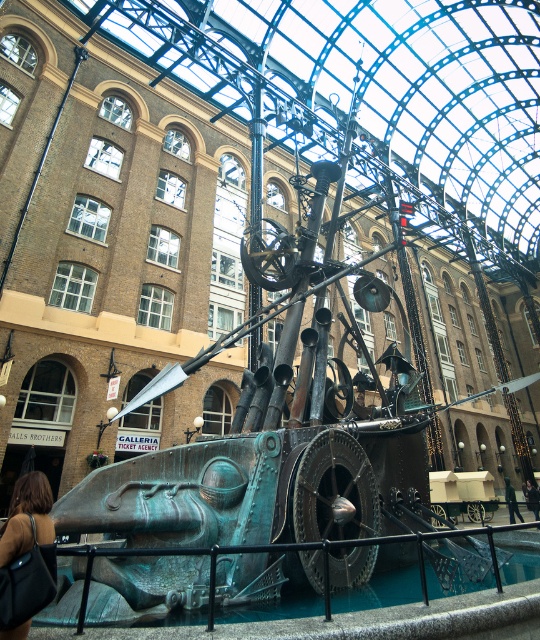
You are an art curator standing in front of the mechanical whale sculpture. You notice two jackets nearby. Which jacket is closer to the sculpture? The green fabric jacket at lower right or the dark brown leather jacket at lower center?

The dark brown leather jacket at lower center is closer to the sculpture because it is positioned at the lower center, while the green fabric jacket at lower right is to the left of it, meaning it is further away from the sculpture.

You are standing in the atrium and want to place a small potted plant on the floor. The potted plant requires a spot that is not occupied by the brown leather bag at lower left. Where should you place it?

The brown leather bag at lower left is located at point (27, 556). To avoid placing the potted plant where the bag is, choose a different coordinate on the floor that does not overlap with this position.

You are standing in the atrium and want to place your items near the mechanical whale sculpture. If you want to place both the brown leather bag at lower left and the green fabric jacket at lower right, which item is closer to the left side of the atrium?

The brown leather bag at lower left is closer to the left side of the atrium because it is positioned to the left of the green fabric jacket at lower right.